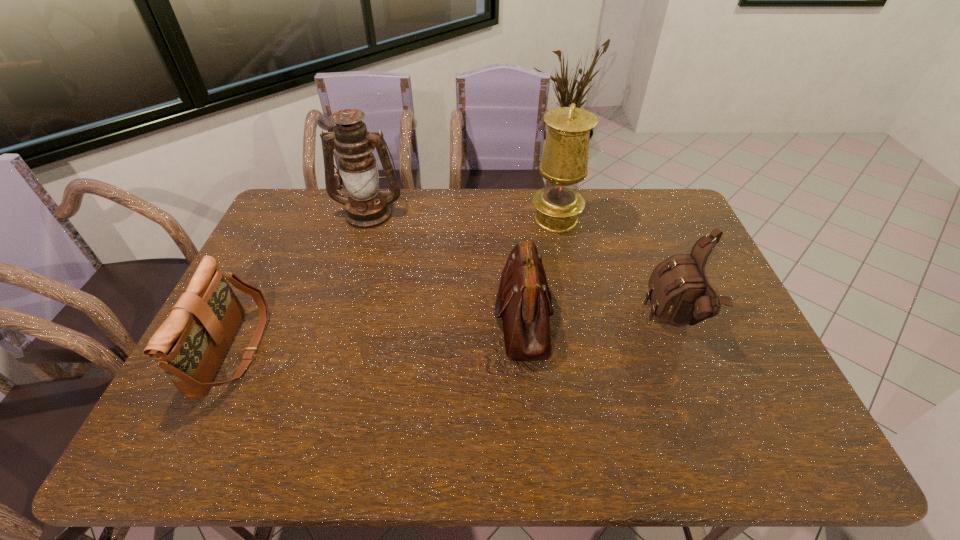
Locate an element on the screen. The height and width of the screenshot is (540, 960). free space between the leftmost object and the left lantern is located at coordinates (301, 282).

Find the location of `empty space between the leftmost shoulder bag and the second object from left to right`. empty space between the leftmost shoulder bag and the second object from left to right is located at coordinates (301, 282).

Find the location of a particular element. The height and width of the screenshot is (540, 960). vacant area that lies between the rightmost object and the right lantern is located at coordinates (615, 271).

This screenshot has height=540, width=960. In order to click on vacant space that is in between the leftmost shoulder bag and the second shoulder bag from right to left in this screenshot , I will do `click(378, 333)`.

This screenshot has width=960, height=540. I want to click on vacant region between the right lantern and the rightmost object, so click(x=615, y=271).

This screenshot has height=540, width=960. What are the coordinates of `free spot between the second shoulder bag from left to right and the fourth object from right to left` in the screenshot? It's located at (446, 265).

The height and width of the screenshot is (540, 960). Identify the location of empty space that is in between the leftmost shoulder bag and the second shoulder bag from right to left. (378, 333).

This screenshot has height=540, width=960. Identify the location of free spot between the right lantern and the rightmost object. (615, 271).

The height and width of the screenshot is (540, 960). What are the coordinates of `free point between the leftmost object and the right lantern` in the screenshot? It's located at (395, 285).

Select which object is the second closest to the rightmost shoulder bag. Please provide its 2D coordinates. Your answer should be formatted as a tuple, i.e. [(x, y)], where the tuple contains the x and y coordinates of a point satisfying the conditions above.

[(564, 162)]